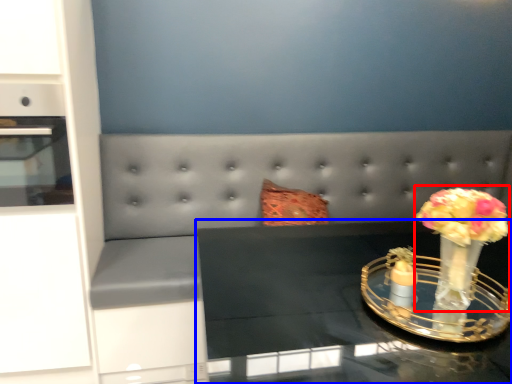
Question: Which object is closer to the camera taking this photo, floral arrangement (highlighted by a red box) or table (highlighted by a blue box)?

Choices:
 (A) floral arrangement
 (B) table

Answer: (B)